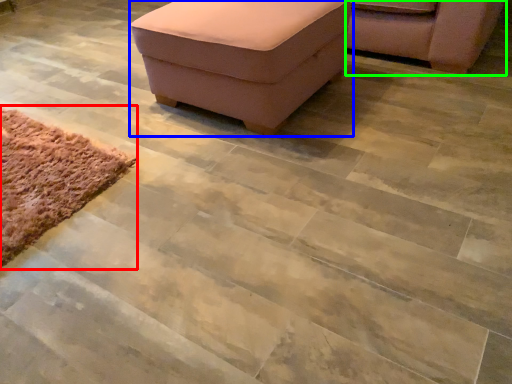
Question: Based on their relative distances, which object is nearer to mat (highlighted by a red box)? Choose from furniture (highlighted by a blue box) and chair (highlighted by a green box).

Choices:
 (A) furniture
 (B) chair

Answer: (A)